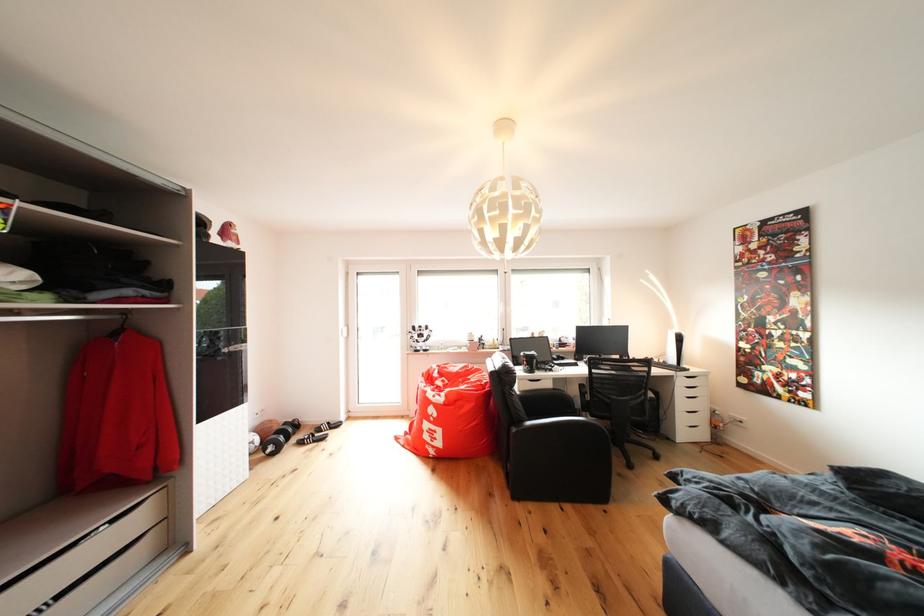
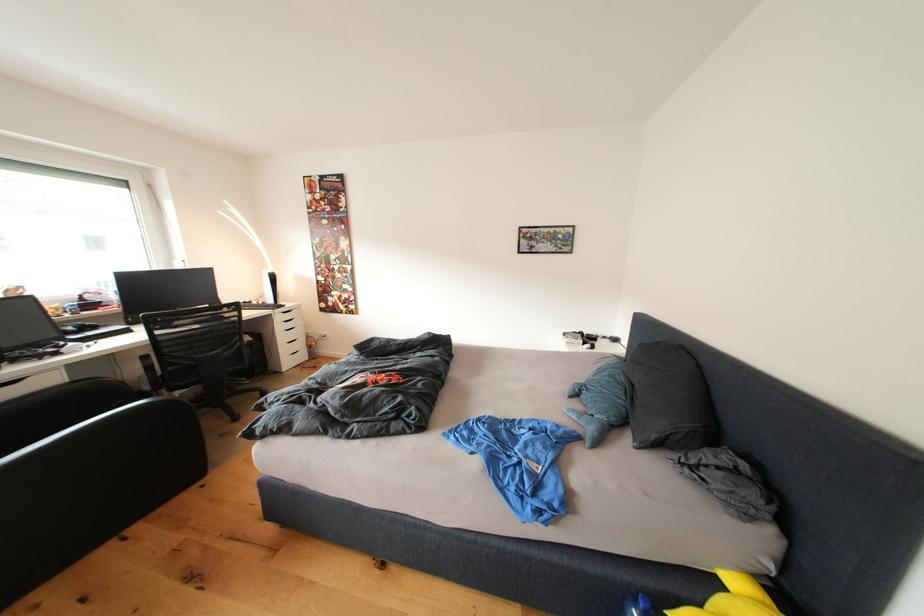
Question: Based on the continuous images, in which direction is the camera rotating? Reply with the corresponding letter.

Choices:
 (A) Left
 (B) Right
 (C) Up
 (D) Down

Answer: (B)